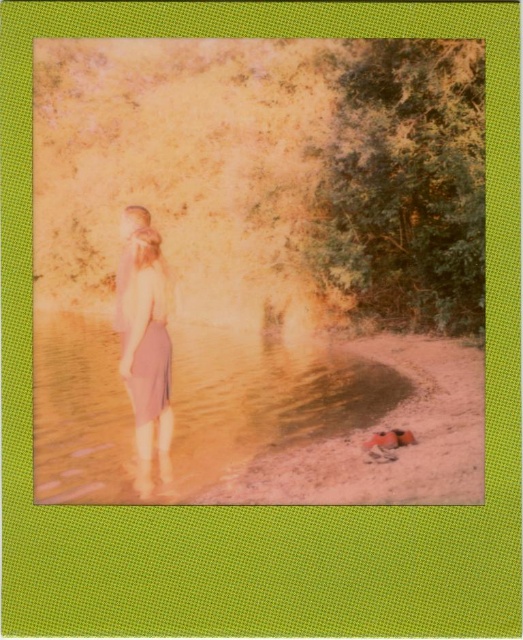
Question: Which of the following is the farthest from the observer?

Choices:
 (A) pos(111,404)
 (B) pos(160,256)
 (C) pos(131,397)
 (D) pos(325,499)

Answer: (A)

Question: Which object is farther from the camera taking this photo?

Choices:
 (A) smooth orange sand at lower right
 (B) pink fabric dress at center
 (C) translucent sand at lower center

Answer: (B)

Question: Is translucent sand at lower center above pink fabric dress at center?

Choices:
 (A) yes
 (B) no

Answer: (B)

Question: Observing the image, what is the correct spatial positioning of smooth orange sand at lower right in reference to pink fabric dress at center?

Choices:
 (A) below
 (B) above

Answer: (A)

Question: Based on their relative distances, which object is farther from the pink fabric dress at center?

Choices:
 (A) translucent sand at lower center
 (B) pink satin dress at center
 (C) smooth orange sand at lower right

Answer: (A)

Question: Is the position of translucent sand at lower center more distant than that of smooth orange sand at lower right?

Choices:
 (A) yes
 (B) no

Answer: (A)